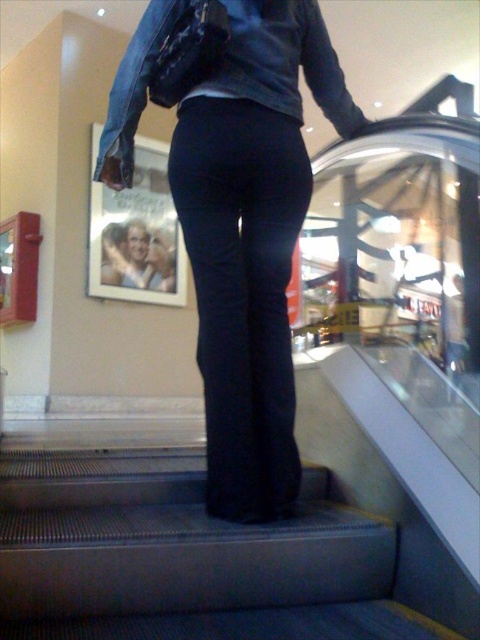
Who is shorter, black fabric stairs at center or dark blue jeans at center?

black fabric stairs at center

Does black fabric stairs at center appear over dark blue jeans at center?

Actually, black fabric stairs at center is below dark blue jeans at center.

Between point (266, 547) and point (134, 35), which one is positioned in front?

Point (266, 547)

Where is `black fabric stairs at center`? black fabric stairs at center is located at coordinates (194, 557).

Who is positioned more to the left, dark blue jeans at center or denim jacket at upper center?

denim jacket at upper center is more to the left.

Is dark blue jeans at center positioned in front of denim jacket at upper center?

Yes, it is in front of denim jacket at upper center.

Which is behind, point (212, 275) or point (312, 65)?

The point (312, 65) is behind.

Where is `dark blue jeans at center`? This screenshot has height=640, width=480. dark blue jeans at center is located at coordinates (252, 240).

Is black fabric stairs at center to the right of denim jacket at upper center from the viewer's perspective?

In fact, black fabric stairs at center is to the left of denim jacket at upper center.

Is point (48, 488) farther from viewer compared to point (170, 1)?

Yes, it is behind point (170, 1).

Between point (228, 627) and point (292, 90), which one is positioned in front?

Point (228, 627) is in front.

In order to click on black fabric stairs at center in this screenshot , I will do `click(194, 557)`.